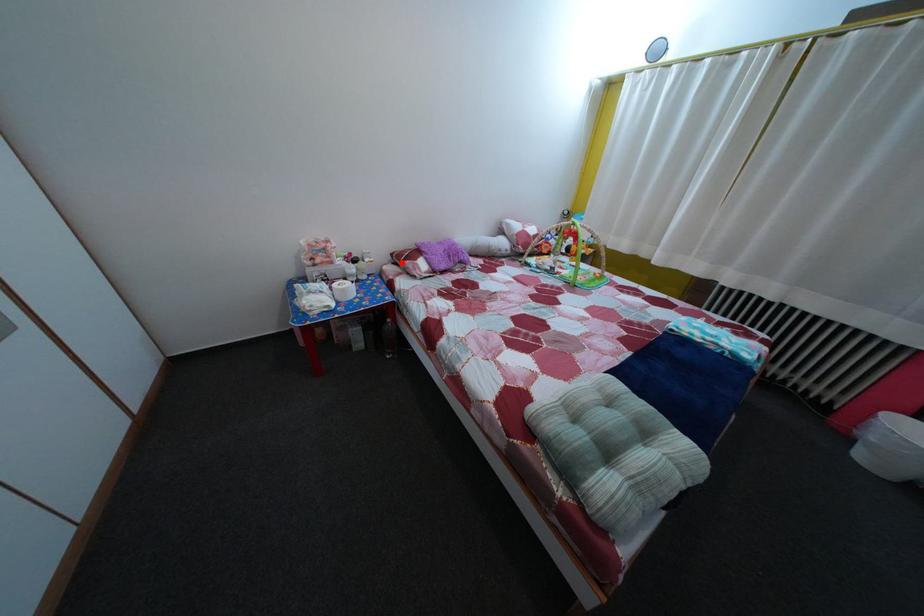
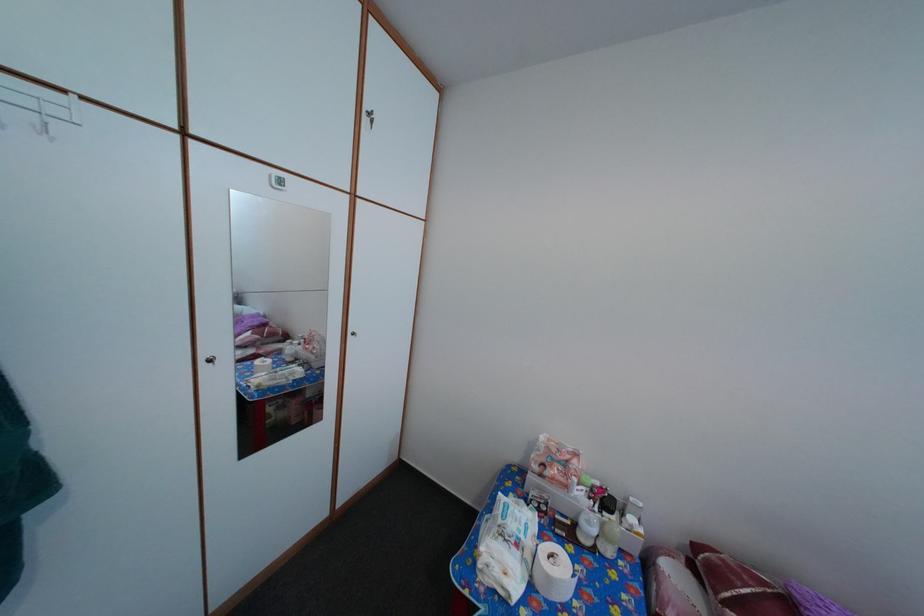
The point at the highlighted location is marked in the first image. Where is the corresponding point in the second image?

(704, 554)